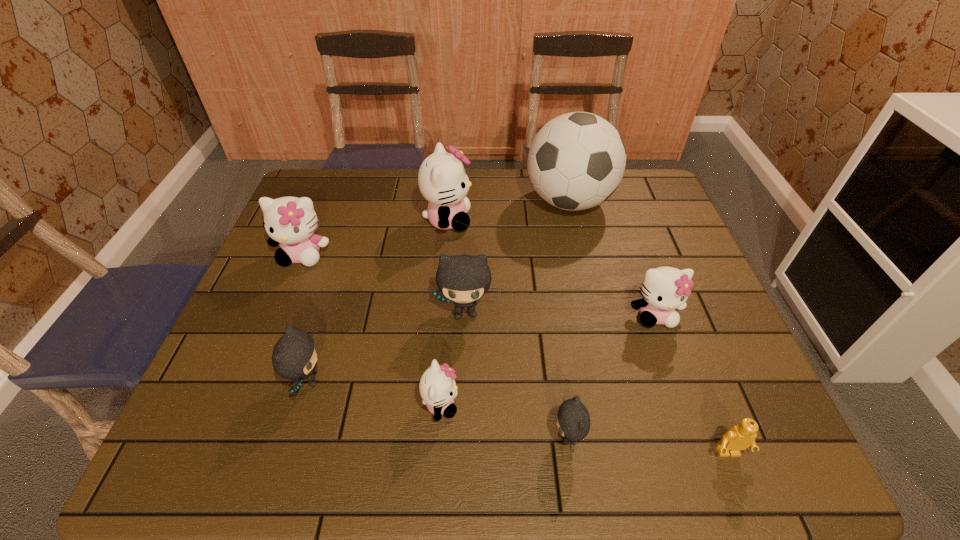
Find the location of a particular element. the nearest white kitten is located at coordinates (437, 387).

Locate an element on the screen. Lego is located at coordinates coord(740,437).

At what (x,y) coordinates should I click in order to perform the action: click on the smallest gray kitten. Please return your answer as a coordinate pair (x, y). The width and height of the screenshot is (960, 540). Looking at the image, I should click on (573, 422).

This screenshot has width=960, height=540. I want to click on the second kitten from right to left, so click(x=573, y=422).

Locate an element on the screen. Image resolution: width=960 pixels, height=540 pixels. vacant space located 0.140m on the right of the soccer ball is located at coordinates (657, 202).

At what (x,y) coordinates should I click in order to perform the action: click on vacant space positioned on the front-facing side of the biggest white kitten. Please return your answer as a coordinate pair (x, y). Looking at the image, I should click on (596, 220).

Where is `blank area located 0.300m on the front-facing side of the third smallest white kitten`? This screenshot has width=960, height=540. blank area located 0.300m on the front-facing side of the third smallest white kitten is located at coordinates (258, 364).

Where is `free space located on the front-facing side of the biggest gray kitten`? free space located on the front-facing side of the biggest gray kitten is located at coordinates 463,404.

Locate an element on the screen. The image size is (960, 540). vacant space located on the front-facing side of the rightmost kitten is located at coordinates (708, 467).

Find the location of a particular element. vacant space located on the front-facing side of the second smallest gray kitten is located at coordinates (368, 380).